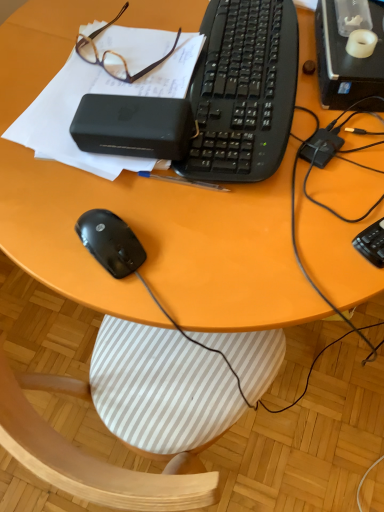
Where is `free location in front of brown plastic glasses at upper left`? The width and height of the screenshot is (384, 512). free location in front of brown plastic glasses at upper left is located at coordinates (76, 105).